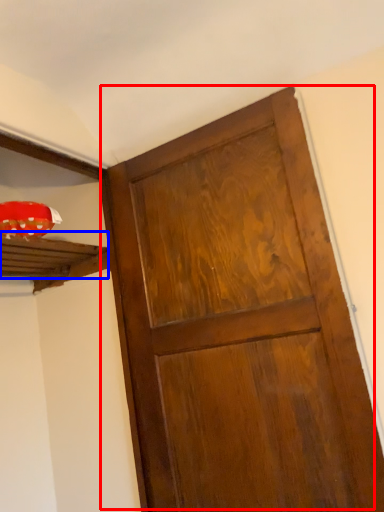
Question: Which object is further to the camera taking this photo, door (highlighted by a red box) or shelf (highlighted by a blue box)?

Choices:
 (A) door
 (B) shelf

Answer: (B)